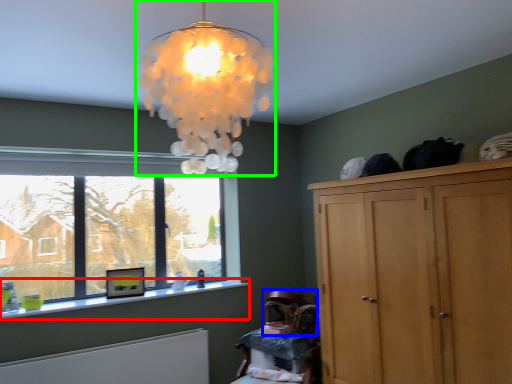
Question: Considering the real-world distances, which object is closest to window sill (highlighted by a red box)? armchair (highlighted by a blue box) or lamp (highlighted by a green box).

Choices:
 (A) armchair
 (B) lamp

Answer: (A)